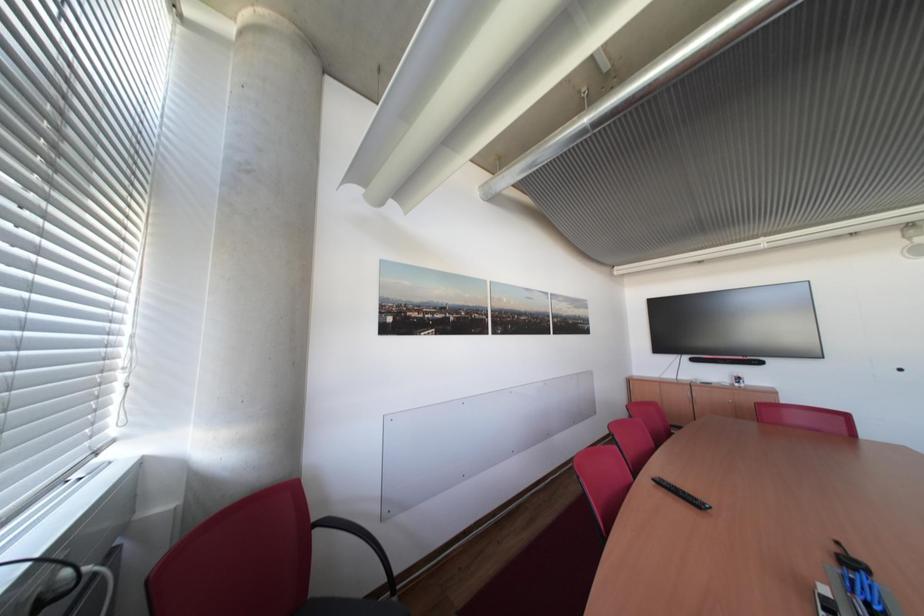
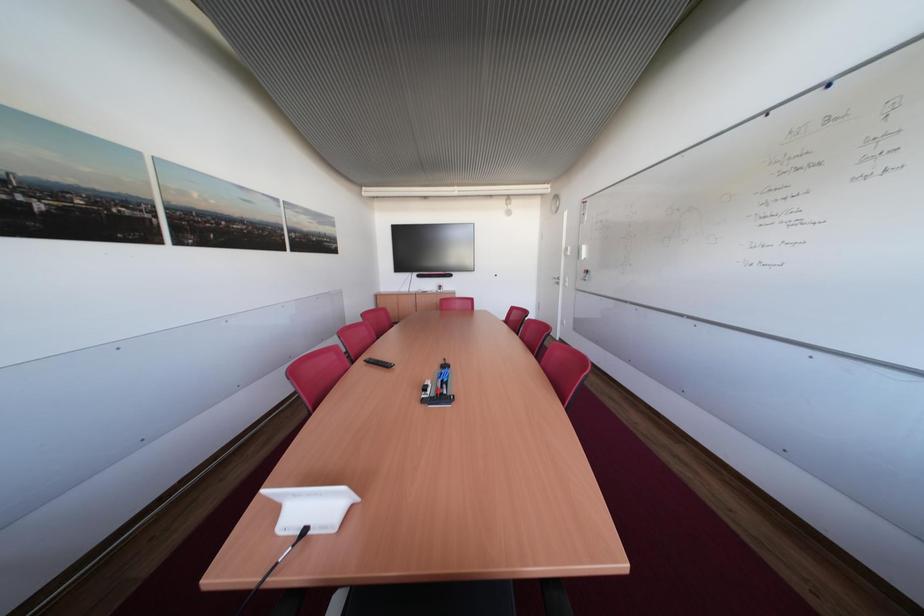
Question: The camera is either moving clockwise (left) or counter-clockwise (right) around the object. The first image is from the beginning of the video and the second image is from the end. Is the camera moving left or right when shooting the video?

Choices:
 (A) Left
 (B) Right

Answer: (A)